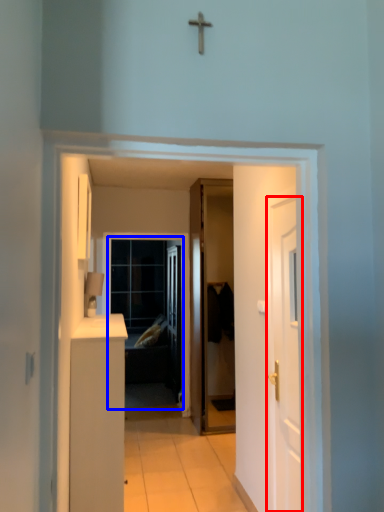
Question: Which object appears farthest to the camera in this image, door (highlighted by a red box) or screen door (highlighted by a blue box)?

Choices:
 (A) door
 (B) screen door

Answer: (B)